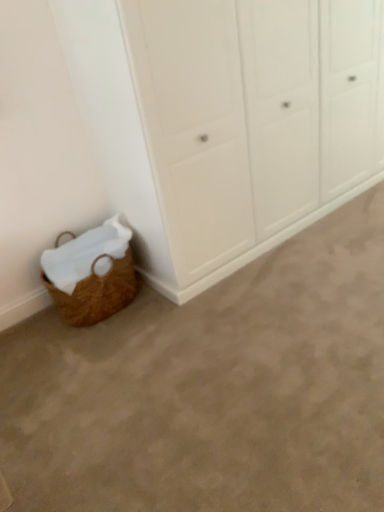
Question: From a real-world perspective, relative to brown woven basket at lower left, is brown woven basket at lower left vertically above or below?

Choices:
 (A) above
 (B) below

Answer: (A)

Question: Based on their sizes in the image, would you say brown woven basket at lower left is bigger or smaller than brown woven basket at lower left?

Choices:
 (A) big
 (B) small

Answer: (B)

Question: Estimate the real-world distances between objects in this image. Which object is closer to the white matte cupboard at lower left?

Choices:
 (A) brown woven basket at lower left
 (B) brown woven basket at lower left

Answer: (A)

Question: Which object is positioned closest to the brown woven basket at lower left?

Choices:
 (A) brown woven basket at lower left
 (B) white matte cupboard at lower left

Answer: (A)